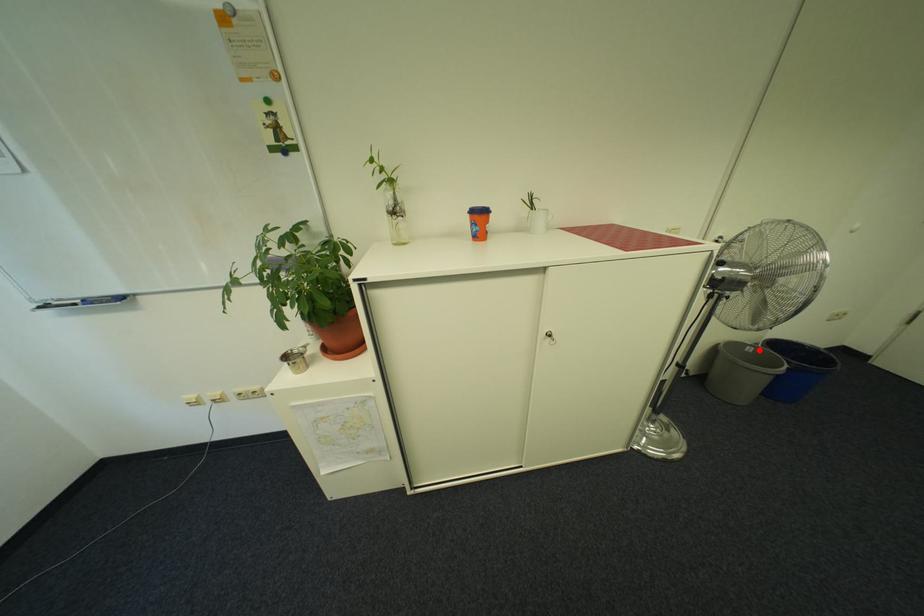
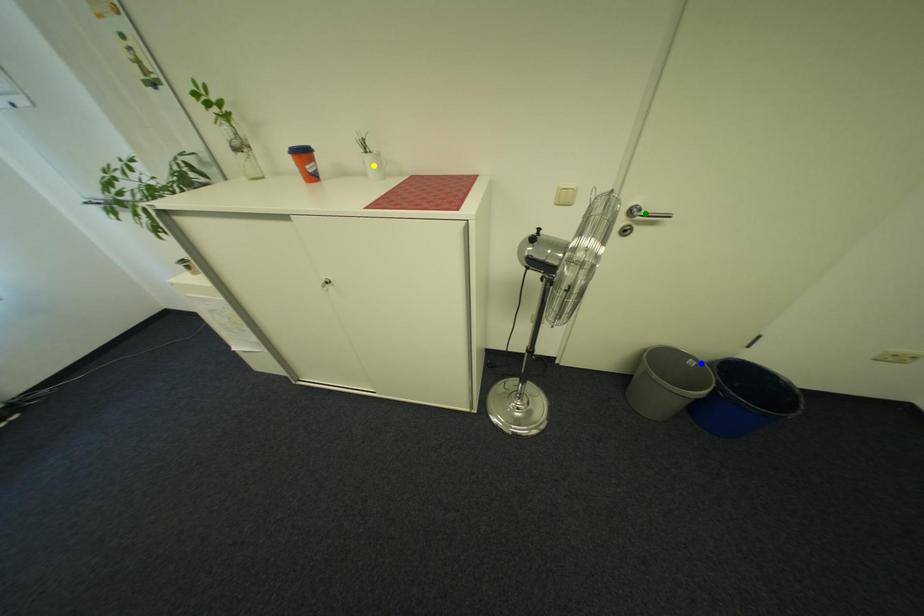
Question: I am providing you with two images of the same scene from different viewpoints. A red point is marked on the first image. You are given multiple points on the second image. In image 2, which mark is for the same physical point as the one in image 1?

Choices:
 (A) blue point
 (B) yellow point
 (C) green point

Answer: (A)